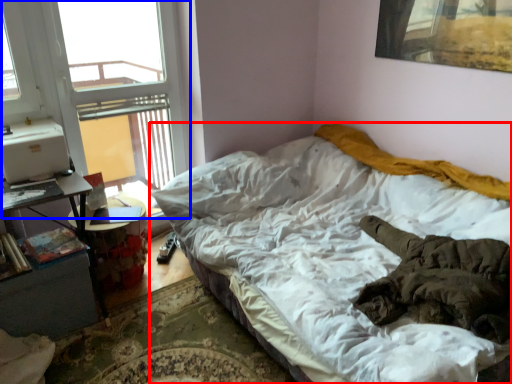
Question: Which of the following is the closest to the observer, bed (highlighted by a red box) or window (highlighted by a blue box)?

Choices:
 (A) bed
 (B) window

Answer: (A)